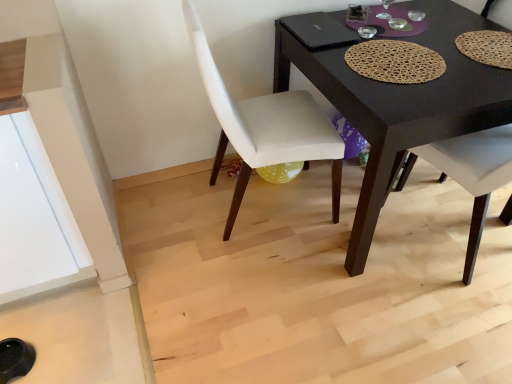
Question: Is black matte desk at center smaller than white fabric chair at center, arranged as the 1th chair when viewed from the left?

Choices:
 (A) no
 (B) yes

Answer: (A)

Question: Can you confirm if black matte desk at center is thinner than white fabric chair at center, the second chair viewed from the right?

Choices:
 (A) no
 (B) yes

Answer: (A)

Question: Is black matte desk at center taller than white fabric chair at center, arranged as the 1th chair when viewed from the left?

Choices:
 (A) yes
 (B) no

Answer: (B)

Question: Is black matte desk at center outside white fabric chair at center, arranged as the 1th chair when viewed from the left?

Choices:
 (A) no
 (B) yes

Answer: (B)

Question: Does black matte desk at center appear on the right side of white fabric chair at center, the second chair viewed from the right?

Choices:
 (A) yes
 (B) no

Answer: (A)

Question: From a real-world perspective, is black matte desk at center below white fabric chair at center, arranged as the 1th chair when viewed from the left?

Choices:
 (A) no
 (B) yes

Answer: (B)

Question: Is black matte desk at center far away from matte woven placemat at upper right, which is counted as the first chair, starting from the right?

Choices:
 (A) yes
 (B) no

Answer: (B)

Question: Does black matte desk at center lie behind matte woven placemat at upper right, the second chair in the left-to-right sequence?

Choices:
 (A) no
 (B) yes

Answer: (A)

Question: From a real-world perspective, does black matte desk at center sit lower than matte woven placemat at upper right, the second chair in the left-to-right sequence?

Choices:
 (A) yes
 (B) no

Answer: (A)

Question: From the image's perspective, is black matte desk at center beneath matte woven placemat at upper right, the second chair in the left-to-right sequence?

Choices:
 (A) no
 (B) yes

Answer: (B)

Question: Does black matte desk at center lie in front of matte woven placemat at upper right, the second chair in the left-to-right sequence?

Choices:
 (A) yes
 (B) no

Answer: (A)

Question: Is black matte desk at center looking in the opposite direction of matte woven placemat at upper right, which is counted as the first chair, starting from the right?

Choices:
 (A) yes
 (B) no

Answer: (B)

Question: Can you confirm if white fabric chair at center, arranged as the 1th chair when viewed from the left, is taller than black matte desk at center?

Choices:
 (A) yes
 (B) no

Answer: (A)